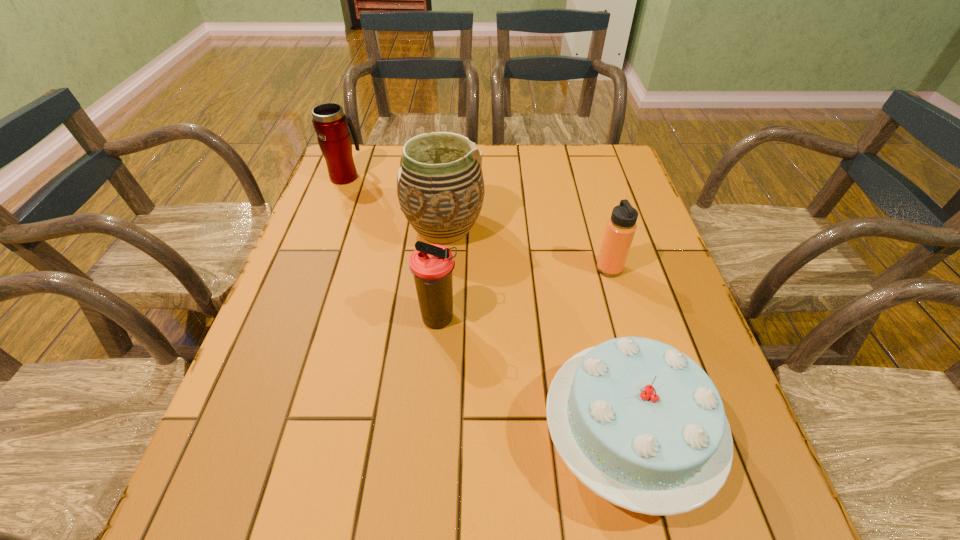
Where is `pottery`? The width and height of the screenshot is (960, 540). pottery is located at coordinates (440, 186).

The height and width of the screenshot is (540, 960). Identify the location of the farthest thermos bottle. pyautogui.click(x=331, y=125).

The height and width of the screenshot is (540, 960). I want to click on the leftmost object, so click(331, 125).

Locate an element on the screen. the nearest thermos bottle is located at coordinates [x=431, y=265].

This screenshot has height=540, width=960. I want to click on the second thermos bottle from left to right, so click(431, 265).

In order to click on the second nearest thermos bottle in this screenshot , I will do `click(621, 227)`.

You are a GUI agent. You are given a task and a screenshot of the screen. Output one action in this format:
    pyautogui.click(x=<x>, y=<y>)
    Task: Click on the rightmost thermos bottle
    This screenshot has height=540, width=960.
    Given the screenshot: What is the action you would take?
    pyautogui.click(x=621, y=227)

Locate an element on the screen. birthday cake is located at coordinates (641, 424).

I want to click on free region located on the left of the fourth nearest object, so click(325, 227).

Where is `free space located on the side with the handle of the farthest thermos bottle`? free space located on the side with the handle of the farthest thermos bottle is located at coordinates (358, 144).